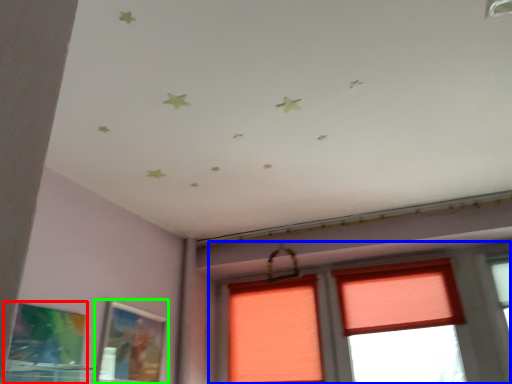
Question: Which is nearer to the picture frame (highlighted by a red box)? window (highlighted by a blue box) or picture frame (highlighted by a green box).

Choices:
 (A) window
 (B) picture frame

Answer: (B)